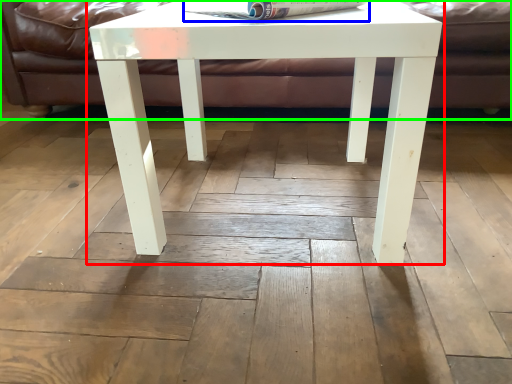
Question: Considering the real-world distances, which object is farthest from table (highlighted by a red box)? magazine (highlighted by a blue box) or couch (highlighted by a green box)?

Choices:
 (A) magazine
 (B) couch

Answer: (B)